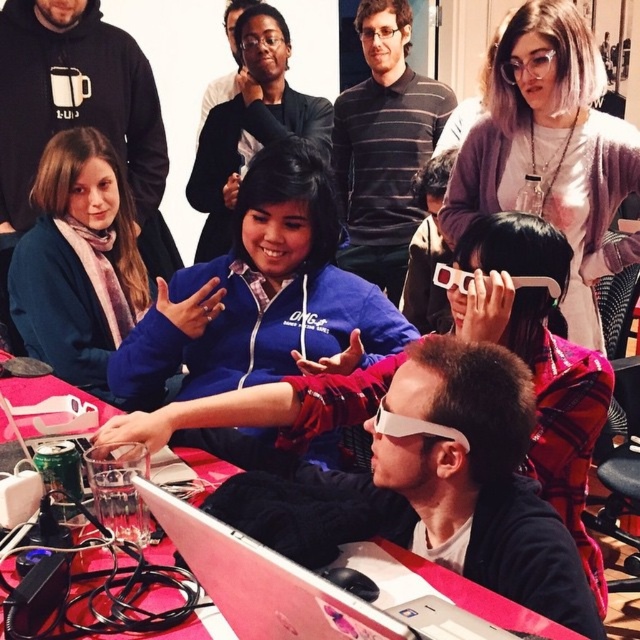
You are holding a camera and want to take a photo of the scene. The camera is currently 69.99 centimeters away from the point at coordinates point (x=262, y=628). If you move the camera closer to the point so that the distance becomes 50 centimeters, will the image of the point appear larger in the photo?

Yes, because when you move the camera closer to the point (x=262, y=628), the distance decreases from 69.99 cm to 50 cm. This reduction in distance will cause the image of the point (x=262, y=628) to appear larger in the photo due to the principles of perspective and camera optics.

You are a photographer setting up for a group photo. You notice two laptops at the center of the table. Which one is taller, the metallic silver laptop at center or the white plastic laptop at center?

The metallic silver laptop at center is taller than the white plastic laptop at center according to the description.